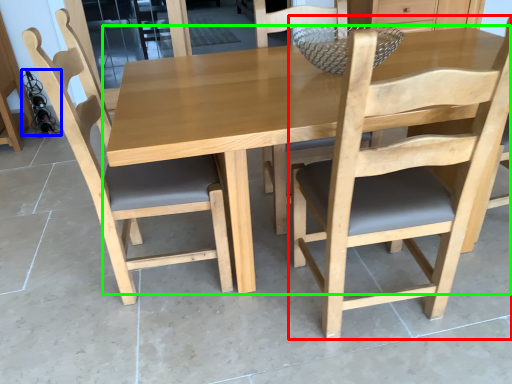
Question: Which object is the closest to the chair (highlighted by a red box)? Choose among these: wine bottle (highlighted by a blue box) or kitchen & dining room table (highlighted by a green box).

Choices:
 (A) wine bottle
 (B) kitchen & dining room table

Answer: (B)